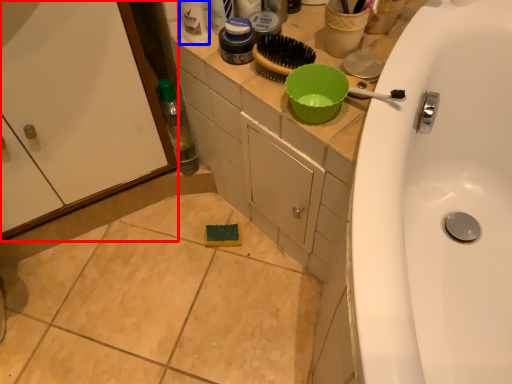
Question: Which of the following is the closest to the observer, screen door (highlighted by a red box) or cleaning product (highlighted by a blue box)?

Choices:
 (A) screen door
 (B) cleaning product

Answer: (A)